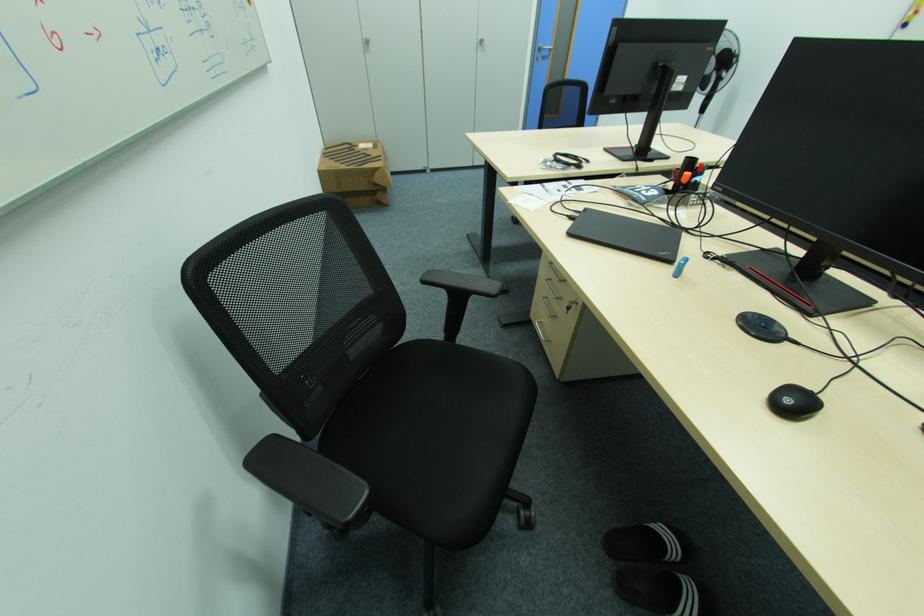
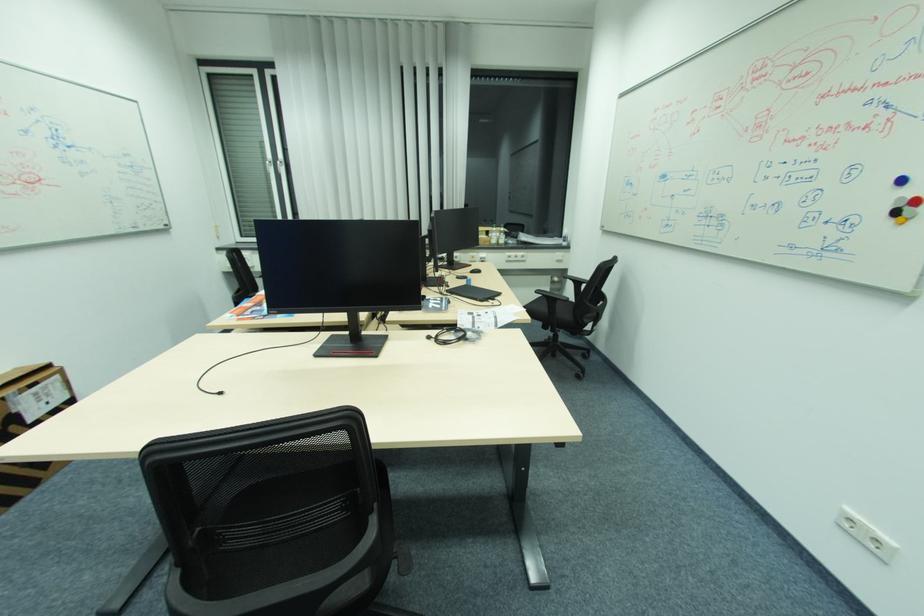
Where in the second image is the point corresponding to (x=592, y=161) from the first image?

(434, 338)